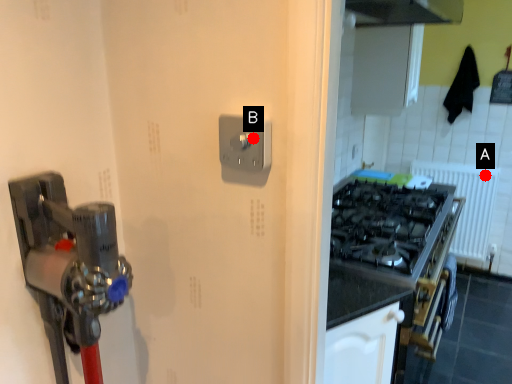
Question: Two points are circled on the image, labeled by A and B beside each circle. Which point is farther from the camera taking this photo?

Choices:
 (A) A is further
 (B) B is further

Answer: (A)